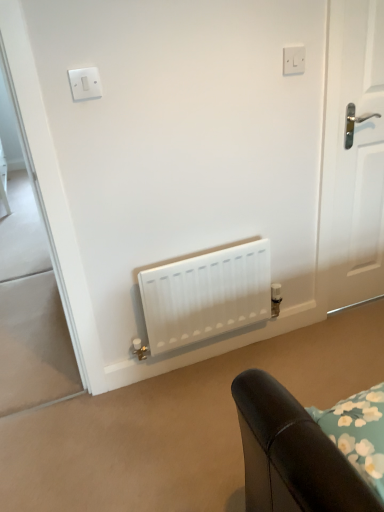
Question: From a real-world perspective, is white matte radiator at center physically located above or below white plastic switch at upper center?

Choices:
 (A) above
 (B) below

Answer: (B)

Question: Considering their positions, is white matte radiator at center located in front of or behind white plastic switch at upper center?

Choices:
 (A) front
 (B) behind

Answer: (B)

Question: Which object is the closest to the white glossy door at right?

Choices:
 (A) white matte radiator at center
 (B) white plastic switch at upper center
 (C) white plastic light switch at upper left

Answer: (B)

Question: Which object is the closest to the white matte radiator at center?

Choices:
 (A) white glossy door at right
 (B) white plastic light switch at upper left
 (C) white plastic switch at upper center

Answer: (A)